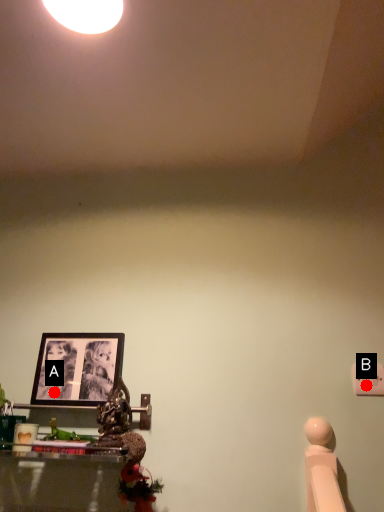
Question: Two points are circled on the image, labeled by A and B beside each circle. Which point is further to the camera?

Choices:
 (A) A is further
 (B) B is further

Answer: (A)